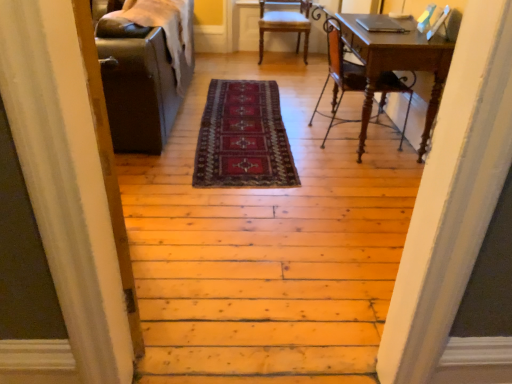
Question: Is the position of dark red woven rug at center less distant than that of wooden chair at right, the second chair from the top?

Choices:
 (A) no
 (B) yes

Answer: (B)

Question: Is wooden chair at right, the second chair from the top, at the back of dark red woven rug at center?

Choices:
 (A) yes
 (B) no

Answer: (B)

Question: Can you confirm if dark red woven rug at center is positioned to the right of wooden chair at right, the 1th chair positioned from the bottom?

Choices:
 (A) yes
 (B) no

Answer: (B)

Question: From a real-world perspective, is dark red woven rug at center over wooden chair at right, the 1th chair positioned from the bottom?

Choices:
 (A) yes
 (B) no

Answer: (B)

Question: From the image's perspective, is dark red woven rug at center under wooden chair at right, the second chair from the top?

Choices:
 (A) no
 (B) yes

Answer: (B)

Question: Is dark red woven rug at center placed right next to wooden chair at right, placed as the second chair when sorted from back to front?

Choices:
 (A) no
 (B) yes

Answer: (A)

Question: Considering the relative sizes of wooden chair at right, the second chair from the top, and wooden floor at center in the image provided, is wooden chair at right, the second chair from the top, smaller than wooden floor at center?

Choices:
 (A) no
 (B) yes

Answer: (B)

Question: From a real-world perspective, is wooden chair at right, the 1th chair positioned from the bottom, physically below wooden floor at center?

Choices:
 (A) no
 (B) yes

Answer: (A)

Question: Does wooden chair at right, which is the 1th chair from front to back, lie in front of wooden floor at center?

Choices:
 (A) yes
 (B) no

Answer: (B)

Question: Could you tell me if wooden chair at right, the second chair from the top, is facing wooden floor at center?

Choices:
 (A) no
 (B) yes

Answer: (A)

Question: Considering the relative sizes of wooden chair at right, the 1th chair positioned from the bottom, and wooden floor at center in the image provided, is wooden chair at right, the 1th chair positioned from the bottom, wider than wooden floor at center?

Choices:
 (A) yes
 (B) no

Answer: (B)

Question: Is there a large distance between wooden chair at right, which is the 1th chair from front to back, and wooden floor at center?

Choices:
 (A) no
 (B) yes

Answer: (A)

Question: Is there a large distance between wooden desk at right and wooden chair at center, the first chair in the top-to-bottom sequence?

Choices:
 (A) yes
 (B) no

Answer: (A)